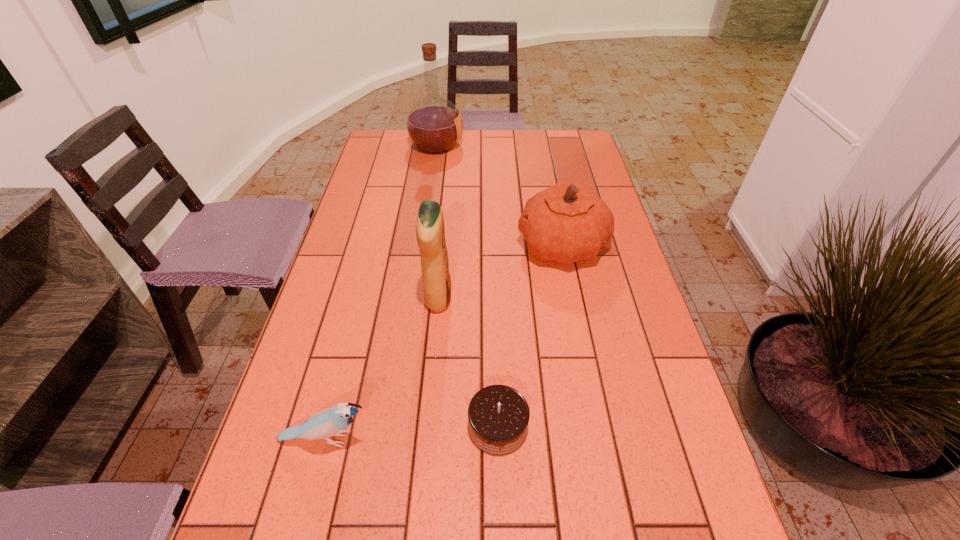
This screenshot has height=540, width=960. What are the coordinates of `free space that satisfies the following two spatial constraints: 1. on the label of the third farthest object; 2. on the back side of the shortest object` in the screenshot? It's located at (427, 426).

Find the location of a particular element. This screenshot has height=540, width=960. free space that satisfies the following two spatial constraints: 1. on the front side of the second object from right to left; 2. at the face of the bird is located at coordinates (498, 440).